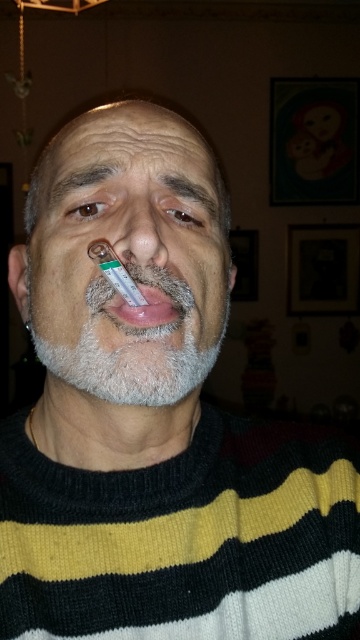
Does point (151, 333) come in front of point (182, 218)?

Yes, point (151, 333) is in front of point (182, 218).

Can you confirm if white matte thermometer at center is positioned below brown hair at upper center?

Yes.

Between point (151, 387) and point (182, 180), which one is positioned behind?

The point (182, 180) is more distant.

I want to click on white matte thermometer at center, so click(x=129, y=257).

Is smooth skin nose at center closer to camera compared to pink glossy lips at center?

Yes, it is in front of pink glossy lips at center.

Is point (119, 227) farther from viewer compared to point (177, 321)?

Yes.

At what (x,y) coordinates should I click in order to perform the action: click on smooth skin nose at center. Please return your answer as a coordinate pair (x, y). Looking at the image, I should click on (137, 230).

Does pink glossy lips at center have a smaller size compared to brown hair at upper center?

Correct, pink glossy lips at center occupies less space than brown hair at upper center.

Which is in front, point (155, 298) or point (163, 173)?

Point (155, 298)

Where is `pink glossy lips at center`? The width and height of the screenshot is (360, 640). pink glossy lips at center is located at coordinates (145, 310).